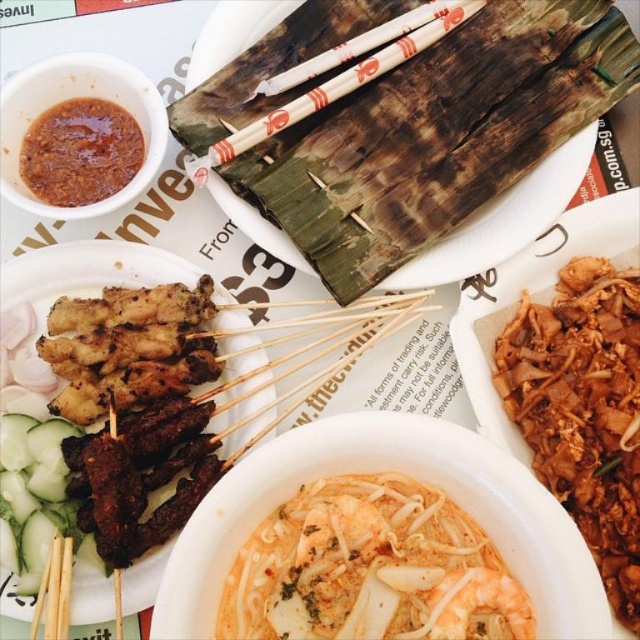
Between brown crispy noodles at right and brown textured leaves at upper center, which one has more height?

brown textured leaves at upper center is taller.

Who is more forward, (600, 541) or (428, 273)?

Point (600, 541) is more forward.

In order to click on brown crispy noodles at right in this screenshot , I will do `click(582, 410)`.

Does point (481, 230) come behind point (403, 44)?

No, (481, 230) is in front of (403, 44).

Can you confirm if brown textured leaves at upper center is positioned above white wood chopsticks at center?

No, brown textured leaves at upper center is not above white wood chopsticks at center.

Does point (580, 136) lie behind point (317, 60)?

No, it is in front of (317, 60).

I want to click on brown textured leaves at upper center, so click(x=502, y=220).

Does point (390, 618) come closer to viewer compared to point (198, 285)?

Yes, it is.

Who is positioned more to the right, shiny orange noodles at center or grilled meat at left?

Result: Positioned to the right is shiny orange noodles at center.

Locate an element on the screen. shiny orange noodles at center is located at coordinates (371, 568).